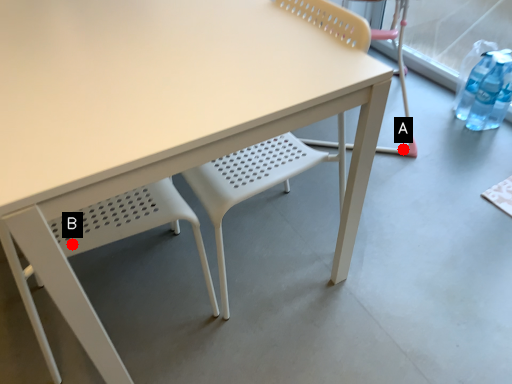
Question: Two points are circled on the image, labeled by A and B beside each circle. Which point is closer to the camera taking this photo?

Choices:
 (A) A is closer
 (B) B is closer

Answer: (B)